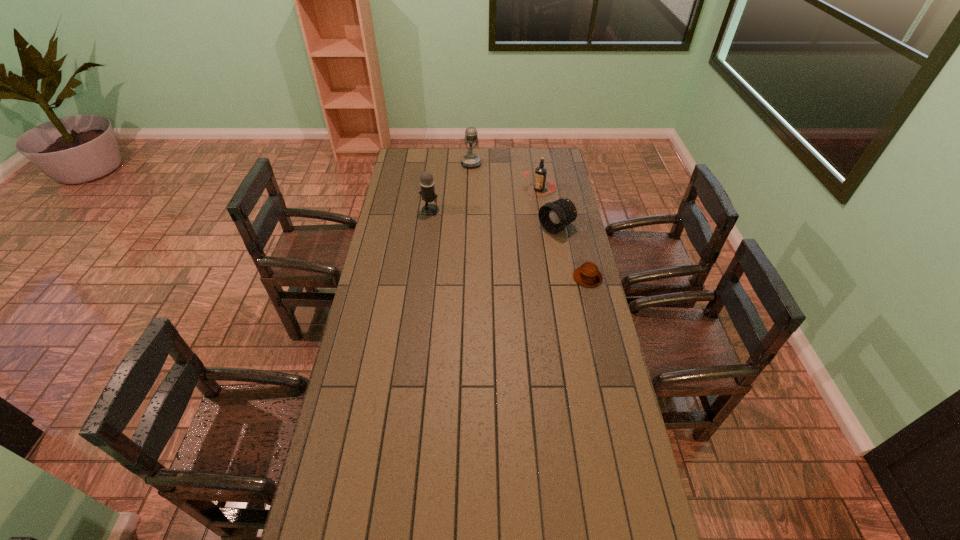
The image size is (960, 540). Find the location of `vacant space on the desktop that is between the nearer microphone and the muffin and is positioned at the front element of the second shortest object`. vacant space on the desktop that is between the nearer microphone and the muffin and is positioned at the front element of the second shortest object is located at coordinates (520, 248).

The width and height of the screenshot is (960, 540). I want to click on vacant spot on the desktop that is between the leftmost object and the muffin and is positioned on the label of the root beer, so click(480, 232).

Locate an element on the screen. free space on the desktop that is between the left microphone and the shortest object and is positioned on the front-facing side of the right microphone is located at coordinates (487, 234).